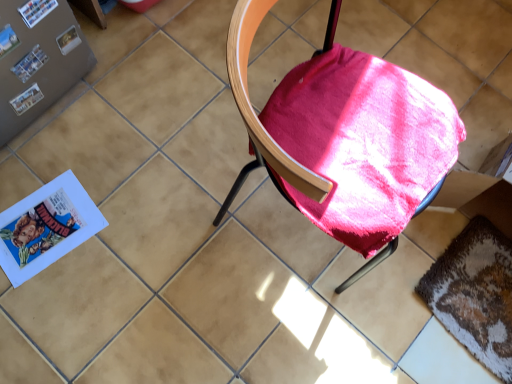
Find the location of a particular element. Image resolution: width=512 pixels, height=384 pixels. vacant region under velvet-like pink cushion at center (from a real-world perspective) is located at coordinates (285, 223).